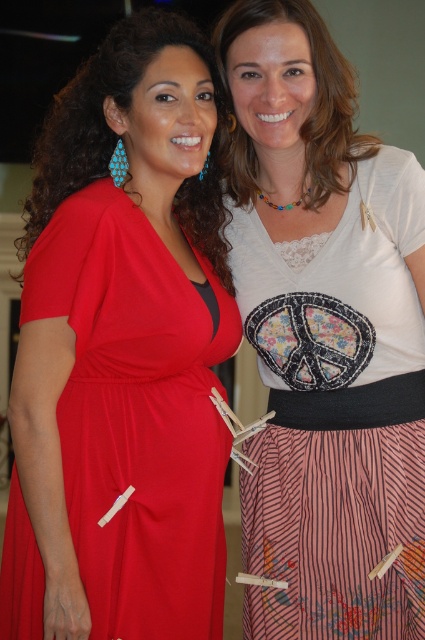
Question: Which point is closer to the camera?

Choices:
 (A) matte red dress at left
 (B) white lace top at center

Answer: (A)

Question: Does matte red dress at left have a smaller size compared to white lace top at center?

Choices:
 (A) yes
 (B) no

Answer: (B)

Question: Does matte red dress at left come in front of white lace top at center?

Choices:
 (A) no
 (B) yes

Answer: (B)

Question: Observing the image, what is the correct spatial positioning of matte red dress at left in reference to white lace top at center?

Choices:
 (A) right
 (B) left

Answer: (B)

Question: Which object is closer to the camera taking this photo?

Choices:
 (A) matte red dress at left
 (B) white lace top at center

Answer: (A)

Question: Which of the following is the farthest from the observer?

Choices:
 (A) (286, 432)
 (B) (181, 138)

Answer: (A)